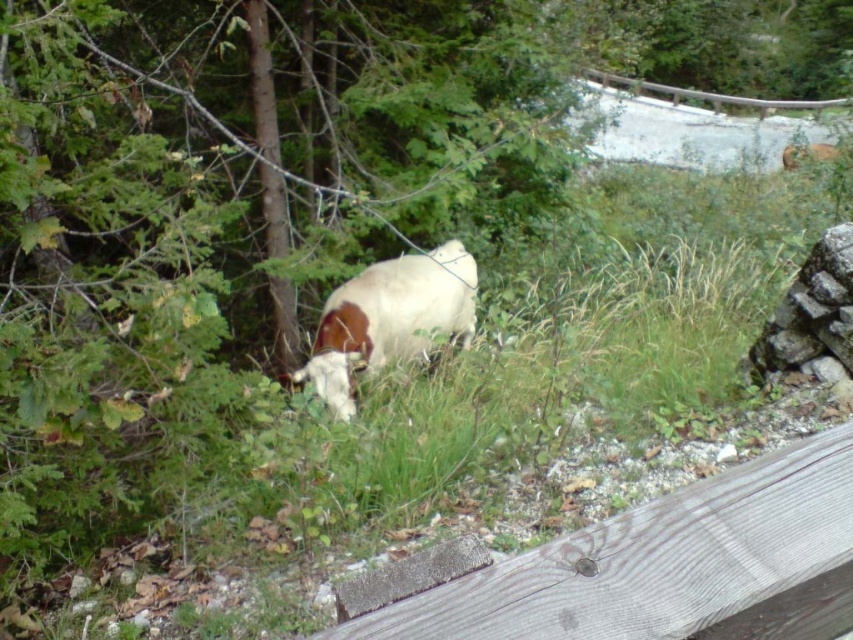
Question: Is gray wood fence at lower right wider than white woolen goat at upper right?

Choices:
 (A) no
 (B) yes

Answer: (A)

Question: Where is gray wood fence at lower right located in relation to white woolen goat at upper right in the image?

Choices:
 (A) above
 (B) below

Answer: (B)

Question: Estimate the real-world distances between objects in this image. Which object is farther from the white woolen goat at center?

Choices:
 (A) gray wood fence at lower right
 (B) white woolen goat at upper right

Answer: (B)

Question: Observing the image, what is the correct spatial positioning of white woolen goat at center in reference to white woolen goat at upper right?

Choices:
 (A) left
 (B) right

Answer: (A)

Question: Which object is positioned farthest from the white woolen goat at center?

Choices:
 (A) white woolen goat at upper right
 (B) gray wood fence at lower right

Answer: (A)

Question: Which point appears farthest from the camera in this image?

Choices:
 (A) (787, 547)
 (B) (463, 257)
 (C) (802, 147)

Answer: (C)